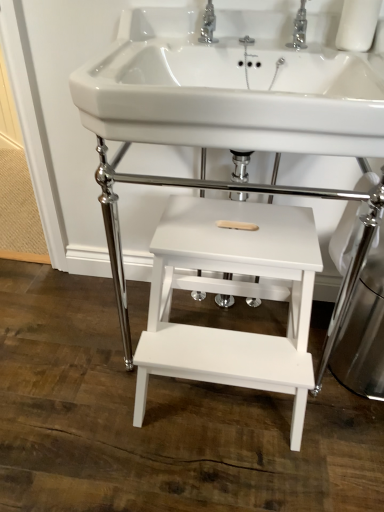
Question: Considering the positions of white glossy sink at center and white matte wood step stool at center, which is the 1th table from top to bottom, in the image, is white glossy sink at center wider or thinner than white matte wood step stool at center, which is the 1th table from top to bottom,?

Choices:
 (A) wide
 (B) thin

Answer: (A)

Question: In the image, is white glossy sink at center positioned in front of or behind white matte wood step stool at center, which is the 1th table from top to bottom?

Choices:
 (A) front
 (B) behind

Answer: (A)

Question: Estimate the real-world distances between objects in this image. Which object is farther from the white glossy sink at center?

Choices:
 (A) white matte wood step stool at center, which is the second table in bottom-to-top order
 (B) white wood step stool at center, the second table when ordered from top to bottom
 (C) polished chrome tap at upper center, arranged as the 1th tap when viewed from the left
 (D) chrome metallic tap at upper center, positioned as the second tap in left-to-right order

Answer: (B)

Question: Which is nearer to the chrome metallic tap at upper center, positioned as the second tap in left-to-right order?

Choices:
 (A) white glossy sink at center
 (B) white wood step stool at center, which appears as the first table when ordered from the bottom
 (C) white matte wood step stool at center, which is the second table in bottom-to-top order
 (D) polished chrome tap at upper center, arranged as the 1th tap when viewed from the left

Answer: (D)